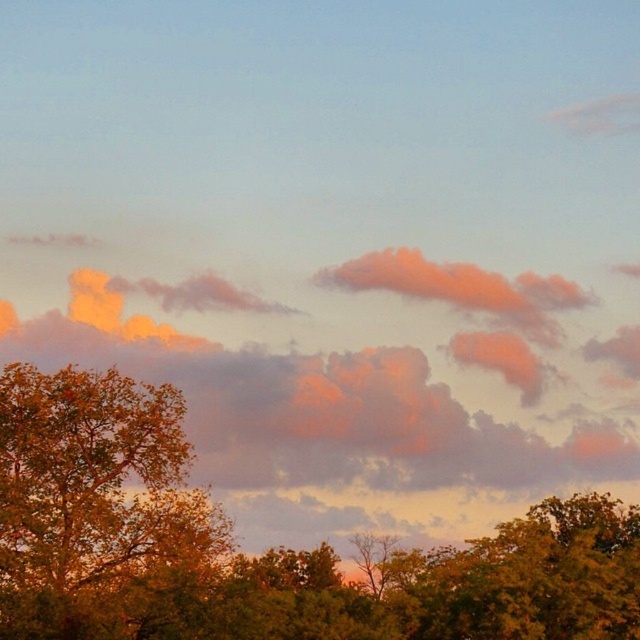
You are an artist setting up your easel to paint the sunset scene. You want to emphasize the depth of the landscape by focusing on the green leafy tree at center and the golden textured leaves at left. Which object should you paint first to create a sense of depth?

To create a sense of depth, you should paint the green leafy tree at center first since it is closer to the viewer than the golden textured leaves at left, allowing the background elements to recede visually.

You are an artist trying to paint the sunset scene. You want to ensure the orange cotton clouds at center and golden textured leaves at left are placed correctly. Based on the scene description, which object should be painted higher in the composition?

The orange cotton clouds at center should be painted higher in the composition because they are positioned over the golden textured leaves at left.